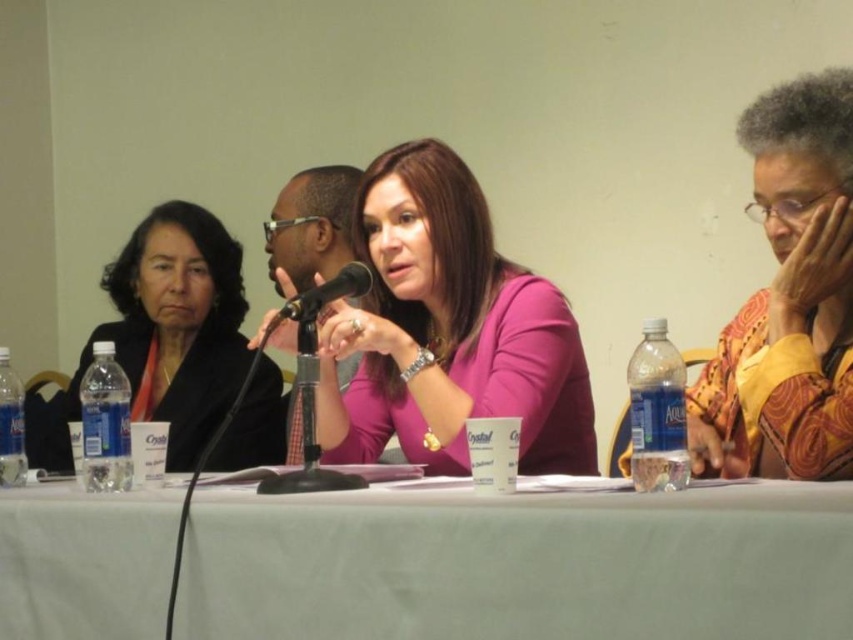
Does white fabric table at center appear on the right side of matte black jacket at left?

Indeed, white fabric table at center is positioned on the right side of matte black jacket at left.

Is white fabric table at center wider than matte black jacket at left?

Correct, the width of white fabric table at center exceeds that of matte black jacket at left.

Between point (390, 611) and point (260, 429), which one is positioned behind?

The point (260, 429) is more distant.

This screenshot has height=640, width=853. Find the location of `white fabric table at center`. white fabric table at center is located at coordinates point(521,564).

Between pink matte shirt at center and matte black jacket at left, which one appears on the right side from the viewer's perspective?

pink matte shirt at center is more to the right.

Between pink matte shirt at center and matte black jacket at left, which one has more height?

Standing taller between the two is matte black jacket at left.

You are a GUI agent. You are given a task and a screenshot of the screen. Output one action in this format:
    pyautogui.click(x=<x>, y=<y>)
    Task: Click on the pink matte shirt at center
    This screenshot has height=640, width=853.
    Given the screenshot: What is the action you would take?
    click(x=448, y=332)

You are a GUI agent. You are given a task and a screenshot of the screen. Output one action in this format:
    pyautogui.click(x=<x>, y=<y>)
    Task: Click on the pink matte shirt at center
    This screenshot has height=640, width=853.
    Given the screenshot: What is the action you would take?
    pyautogui.click(x=448, y=332)

Can you confirm if matte black jacket at left is positioned to the right of black metallic microphone at center?

No, matte black jacket at left is not to the right of black metallic microphone at center.

Consider the image. Is matte black jacket at left below black metallic microphone at center?

Yes.

Is point (165, 467) in front of point (312, 310)?

No.

You are a GUI agent. You are given a task and a screenshot of the screen. Output one action in this format:
    pyautogui.click(x=<x>, y=<y>)
    Task: Click on the matte black jacket at left
    The width and height of the screenshot is (853, 640).
    Given the screenshot: What is the action you would take?
    pyautogui.click(x=170, y=330)